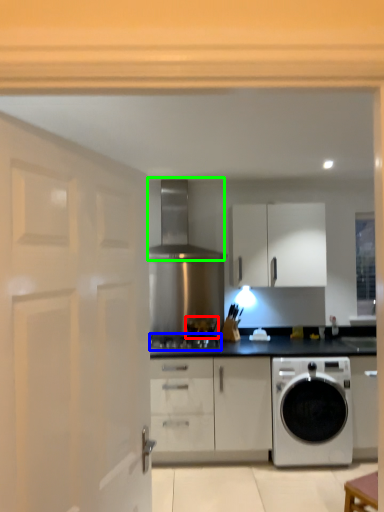
Question: Based on their relative distances, which object is farther from appliance (highlighted by a red box)? Choose from gas stove (highlighted by a blue box) and exhaust hood (highlighted by a green box).

Choices:
 (A) gas stove
 (B) exhaust hood

Answer: (B)